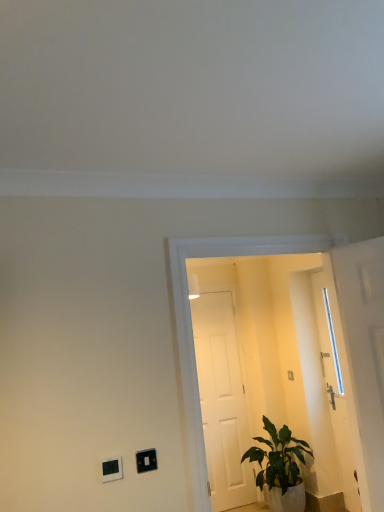
The height and width of the screenshot is (512, 384). What do you see at coordinates (362, 356) in the screenshot? I see `white glossy door at right, placed as the 2th door when sorted from back to front` at bounding box center [362, 356].

The image size is (384, 512). Find the location of `white matte door at center, the 2th door from the front`. white matte door at center, the 2th door from the front is located at coordinates (222, 401).

Can you see green leafy plant at lower right touching white glossy door at right, the 1th door from the front?

No, green leafy plant at lower right is not with white glossy door at right, the 1th door from the front.

Is white glossy door at right, arranged as the 1th door when viewed from the right, located within green leafy plant at lower right?

No, white glossy door at right, arranged as the 1th door when viewed from the right, is located outside of green leafy plant at lower right.

What's the angular difference between green leafy plant at lower right and white glossy door at right, the 1th door from the front,'s facing directions?

21.8 degrees.

Is the position of green leafy plant at lower right less distant than that of white glossy door at right, the 1th door from the front?

No, it is behind white glossy door at right, the 1th door from the front.

Is black plastic light switch at lower left, the first light switch viewed from the left, bigger than white matte door at center, which appears as the 1th door when viewed from the left?

No, black plastic light switch at lower left, the first light switch viewed from the left, is not bigger than white matte door at center, which appears as the 1th door when viewed from the left.

Looking at this image, is black plastic light switch at lower left, which ranks as the 2th light switch in right-to-left order, facing away from white matte door at center, which appears as the 1th door when viewed from the left?

No.

Who is shorter, black plastic light switch at lower left, positioned as the 2th light switch in back-to-front order, or white matte door at center, which appears as the 1th door when viewed from the left?

black plastic light switch at lower left, positioned as the 2th light switch in back-to-front order, is shorter.

Between black plastic light switch at lower left, the 1th light switch positioned from the front, and white matte door at center, which appears as the 1th door when viewed from the left, which one appears on the left side from the viewer's perspective?

From the viewer's perspective, black plastic light switch at lower left, the 1th light switch positioned from the front, appears more on the left side.

Considering the relative positions of black plastic/light switch at lower left, acting as the 1th light switch starting from the right, and green leafy plant at lower right in the image provided, is black plastic/light switch at lower left, acting as the 1th light switch starting from the right, to the left of green leafy plant at lower right from the viewer's perspective?

Indeed, black plastic/light switch at lower left, acting as the 1th light switch starting from the right, is positioned on the left side of green leafy plant at lower right.

In the scene shown: Which is in front, black plastic/light switch at lower left, the 1th light switch in the back-to-front sequence, or green leafy plant at lower right?

black plastic/light switch at lower left, the 1th light switch in the back-to-front sequence, is more forward.

Is black plastic/light switch at lower left, the 1th light switch in the back-to-front sequence, turned away from green leafy plant at lower right?

black plastic/light switch at lower left, the 1th light switch in the back-to-front sequence, does not have its back to green leafy plant at lower right.

Considering the relative sizes of black plastic/light switch at lower left, which is counted as the second light switch, starting from the front, and green leafy plant at lower right in the image provided, is black plastic/light switch at lower left, which is counted as the second light switch, starting from the front, thinner than green leafy plant at lower right?

Correct, the width of black plastic/light switch at lower left, which is counted as the second light switch, starting from the front, is less than that of green leafy plant at lower right.

From the image's perspective, which one is positioned lower, white matte door at center, which appears as the 1th door when viewed from the left, or black plastic light switch at lower left, which ranks as the 2th light switch in right-to-left order?

From the image's view, white matte door at center, which appears as the 1th door when viewed from the left, is below.

This screenshot has height=512, width=384. In order to click on the 1st light switch above the white matte door at center, which is the first door in back-to-front order (from a real-world perspective) in this screenshot , I will do `click(112, 469)`.

Which object is positioned more to the left, white matte door at center, the 2th door from the front, or black plastic light switch at lower left, positioned as the 2th light switch in back-to-front order?

black plastic light switch at lower left, positioned as the 2th light switch in back-to-front order.

Is white matte door at center, acting as the 2th door starting from the right, outside of black plastic light switch at lower left, positioned as the 2th light switch in back-to-front order?

Indeed, white matte door at center, acting as the 2th door starting from the right, is completely outside black plastic light switch at lower left, positioned as the 2th light switch in back-to-front order.

Looking at this image, which point is more forward, (142, 463) or (241, 411)?

The point (142, 463) is in front.

From a real-world perspective, is black plastic/light switch at lower left, which is counted as the second light switch, starting from the front, positioned under white matte door at center, the 2th door from the front, based on gravity?

Actually, black plastic/light switch at lower left, which is counted as the second light switch, starting from the front, is physically above white matte door at center, the 2th door from the front, in the real world.

From the image's perspective, is black plastic/light switch at lower left, the 1th light switch in the back-to-front sequence, on top of white matte door at center, which is the first door in back-to-front order?

Yes, from the image's perspective, black plastic/light switch at lower left, the 1th light switch in the back-to-front sequence, is above white matte door at center, which is the first door in back-to-front order.

Between black plastic/light switch at lower left, which is counted as the second light switch, starting from the front, and white matte door at center, acting as the 2th door starting from the right, which one appears on the left side from the viewer's perspective?

Positioned to the left is black plastic/light switch at lower left, which is counted as the second light switch, starting from the front.

Which is behind, point (122, 472) or point (284, 499)?

The point (284, 499) is farther.

Starting from the green leafy plant at lower right, which light switch is the 2nd one to the left? Please provide its 2D coordinates.

[(112, 469)]

From a real-world perspective, is black plastic light switch at lower left, positioned as the 2th light switch in back-to-front order, above or below green leafy plant at lower right?

black plastic light switch at lower left, positioned as the 2th light switch in back-to-front order, is situated higher than green leafy plant at lower right in the real world.

Is the position of black plastic light switch at lower left, which ranks as the 2th light switch in right-to-left order, more distant than that of green leafy plant at lower right?

No.

Does black plastic light switch at lower left, which ranks as the 2th light switch in right-to-left order, come in front of transparent glass door at center?

Yes, black plastic light switch at lower left, which ranks as the 2th light switch in right-to-left order, is in front of transparent glass door at center.

Is black plastic light switch at lower left, the first light switch viewed from the left, beside transparent glass door at center?

They are not placed beside each other.

Could transparent glass door at center be considered to be inside black plastic light switch at lower left, the 1th light switch positioned from the front?

No.

Is point (121, 467) farther from viewer compared to point (319, 477)?

No, it is not.

Identify the location of door on the right of green leafy plant at lower right. click(362, 356).

Identify the location of door that is below the black plastic light switch at lower left, the 1th light switch positioned from the front (from the image's perspective). (222, 401).

Based on the photo, considering their positions, is black plastic light switch at lower left, which ranks as the 2th light switch in right-to-left order, positioned closer to black plastic/light switch at lower left, which is counted as the second light switch, starting from the front, than white glossy door at right, the 1th door from the front?

black plastic light switch at lower left, which ranks as the 2th light switch in right-to-left order, lies closer to black plastic/light switch at lower left, which is counted as the second light switch, starting from the front, than the other object.

Estimate the real-world distances between objects in this image. Which object is further from white matte door at center, acting as the 2th door starting from the right, green leafy plant at lower right or black plastic/light switch at lower left, marked as the 2th light switch in a left-to-right arrangement?

black plastic/light switch at lower left, marked as the 2th light switch in a left-to-right arrangement, is further to white matte door at center, acting as the 2th door starting from the right.

Looking at the image, which one is located further to black plastic light switch at lower left, the first light switch viewed from the left, white matte door at center, which is the first door in back-to-front order, or white glossy door at right, arranged as the 1th door when viewed from the right?

white matte door at center, which is the first door in back-to-front order, is further to black plastic light switch at lower left, the first light switch viewed from the left.

Considering their positions, is white glossy door at right, arranged as the 1th door when viewed from the right, positioned closer to white matte door at center, acting as the 2th door starting from the right, than black plastic/light switch at lower left, acting as the 1th light switch starting from the right?

The object closer to white matte door at center, acting as the 2th door starting from the right, is white glossy door at right, arranged as the 1th door when viewed from the right.

Looking at this image, from the image, which object appears to be nearer to white matte door at center, the 2th door from the front, green leafy plant at lower right or transparent glass door at center?

transparent glass door at center is positioned closer to the anchor white matte door at center, the 2th door from the front.

Estimate the real-world distances between objects in this image. Which object is closer to white matte door at center, acting as the 2th door starting from the right, transparent glass door at center or white glossy door at right, placed as the 2th door when sorted from back to front?

Based on the image, transparent glass door at center appears to be nearer to white matte door at center, acting as the 2th door starting from the right.

Which object lies further to the anchor point white glossy door at right, placed as the second door when sorted from left to right, green leafy plant at lower right or transparent glass door at center?

transparent glass door at center is further to white glossy door at right, placed as the second door when sorted from left to right.

When comparing their distances from transparent glass door at center, does black plastic light switch at lower left, which ranks as the 2th light switch in right-to-left order, or white glossy door at right, placed as the second door when sorted from left to right, seem closer?

white glossy door at right, placed as the second door when sorted from left to right, is positioned closer to the anchor transparent glass door at center.

Where is `houseplant located between black plastic/light switch at lower left, the 1th light switch in the back-to-front sequence, and white matte door at center, which appears as the 1th door when viewed from the left, in the depth direction`? The height and width of the screenshot is (512, 384). houseplant located between black plastic/light switch at lower left, the 1th light switch in the back-to-front sequence, and white matte door at center, which appears as the 1th door when viewed from the left, in the depth direction is located at coordinates tap(280, 467).

This screenshot has width=384, height=512. In order to click on light switch between black plastic light switch at lower left, which ranks as the 2th light switch in right-to-left order, and white glossy door at right, arranged as the 1th door when viewed from the right, in the horizontal direction in this screenshot , I will do `click(146, 460)`.

Find the location of a particular element. Image resolution: width=384 pixels, height=512 pixels. door between black plastic/light switch at lower left, the 1th light switch in the back-to-front sequence, and white matte door at center, the 2th door from the front, in the front-back direction is located at coordinates (362, 356).

Where is `glass door situated between black plastic/light switch at lower left, acting as the 1th light switch starting from the right, and white glossy door at right, the 1th door from the front, from left to right`? Image resolution: width=384 pixels, height=512 pixels. glass door situated between black plastic/light switch at lower left, acting as the 1th light switch starting from the right, and white glossy door at right, the 1th door from the front, from left to right is located at coordinates (265, 342).